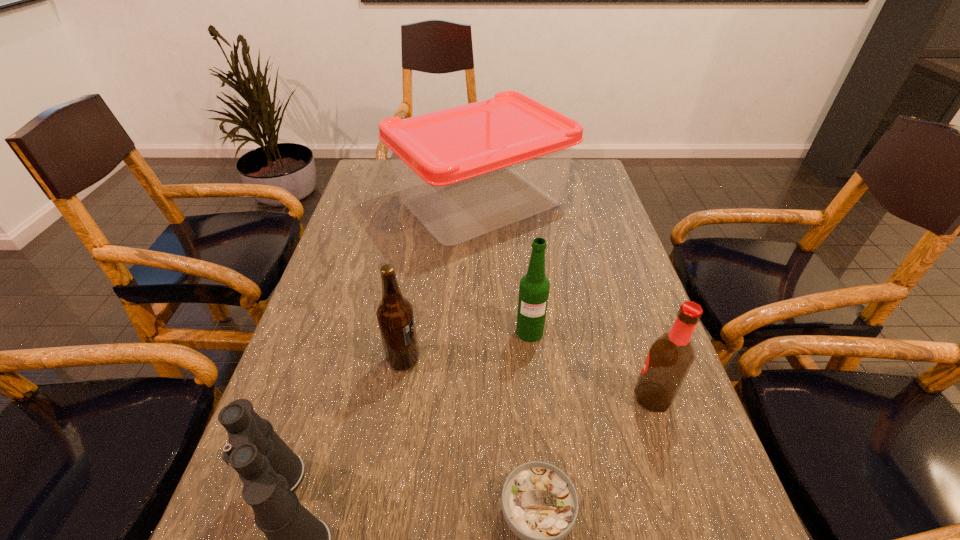
In order to click on free spot between the rightmost beer bottle and the leftmost beer bottle in this screenshot , I will do pyautogui.click(x=528, y=378).

Find the location of `vacant space in between the leftmost beer bottle and the tray`. vacant space in between the leftmost beer bottle and the tray is located at coordinates (442, 281).

In order to click on object that can be found as the second closest to the leftmost beer bottle in this screenshot , I will do `click(534, 288)`.

This screenshot has width=960, height=540. I want to click on the fourth closest object to the soup bowl, so click(534, 288).

Identify which beer bottle is located as the second nearest to the shortest object. Please provide its 2D coordinates. Your answer should be formatted as a tuple, i.e. [(x, y)], where the tuple contains the x and y coordinates of a point satisfying the conditions above.

[(395, 316)]

The image size is (960, 540). I want to click on the third closest beer bottle to the shortest object, so click(x=534, y=288).

Find the location of a particular element. vacant space that satisfies the following two spatial constraints: 1. on the back side of the rightmost beer bottle; 2. on the label of the second farthest beer bottle is located at coordinates (640, 359).

Where is `free region that satisfies the following two spatial constraints: 1. on the front side of the farthest object; 2. on the label of the second nearest beer bottle`? This screenshot has width=960, height=540. free region that satisfies the following two spatial constraints: 1. on the front side of the farthest object; 2. on the label of the second nearest beer bottle is located at coordinates (480, 359).

Identify the location of free location that satisfies the following two spatial constraints: 1. on the label of the second beer bottle from right to left; 2. on the left side of the rightmost object. Image resolution: width=960 pixels, height=540 pixels. (537, 397).

The image size is (960, 540). Identify the location of free space that satisfies the following two spatial constraints: 1. on the label of the second farthest beer bottle; 2. on the back side of the nearest beer bottle. (397, 397).